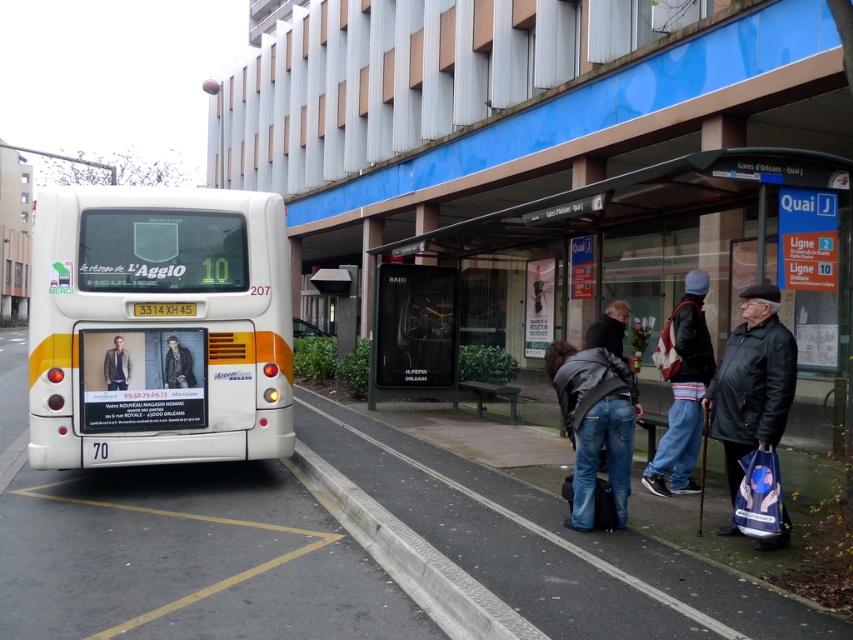
You are standing at the bus stop and want to know the distance between the two points labeled point [381,513] and point [686,445]. Can you calculate it using their coordinates?

The distance between the two points can be calculated using the distance formula. The coordinates are point [381,513] and point [686,445]. The distance is sqrt of the sum of the squared differences in their x and y coordinates. sqrt of sqrt of sqrt of sqrt of sqrt of sqrt of sqrt of sqrt of sqrt of sqrt of sqrt of sqrt of sqrt of sqrt of sqrt of sqrt of sqrt of sqrt of sqrt of sqrt of sqrt of sqrt of sqrt of sqrt of sqrt of sqrt of sqrt of sqrt of sqrt of sqrt of sqrt of sqrt of sqrt of sqrt of sqrt.

You are a pedestrian trying to cross the street at the bus stop. You see the gray concrete curb at lower center and the denim pants at lower right. Which object is wider?

The gray concrete curb at lower center is wider than the denim pants at lower right.